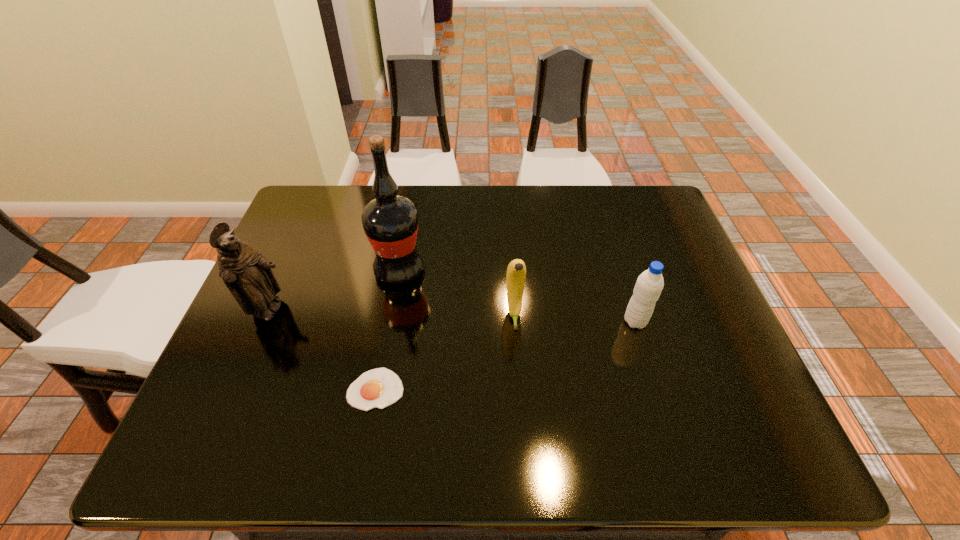
Identify the location of wine bottle. The image size is (960, 540). (390, 222).

I want to click on the farthest object, so click(x=390, y=222).

This screenshot has height=540, width=960. What are the coordinates of `figurine` in the screenshot? It's located at (247, 274).

This screenshot has height=540, width=960. In order to click on the leftmost object in this screenshot , I will do `click(247, 274)`.

You are a GUI agent. You are given a task and a screenshot of the screen. Output one action in this format:
    pyautogui.click(x=<x>, y=<y>)
    Task: Click on the rightmost object
    
    Given the screenshot: What is the action you would take?
    pyautogui.click(x=649, y=285)

The width and height of the screenshot is (960, 540). Find the location of `banana`. banana is located at coordinates (516, 272).

This screenshot has height=540, width=960. Identify the location of the shortest object. coord(379,388).

What are the coordinates of `egg yolk` in the screenshot? It's located at (379, 388).

Find the location of a particular element. The width and height of the screenshot is (960, 540). free spot located 0.140m on the left of the tallest object is located at coordinates (323, 270).

You are a GUI agent. You are given a task and a screenshot of the screen. Output one action in this format:
    pyautogui.click(x=<x>, y=<y>)
    Task: Click on the free space located on the front-facing side of the leftmost object
    
    Given the screenshot: What is the action you would take?
    pyautogui.click(x=316, y=311)